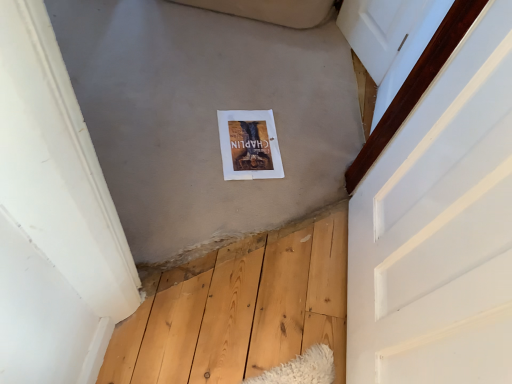
This screenshot has height=384, width=512. Describe the element at coordinates (440, 228) in the screenshot. I see `white painted wood door at upper right` at that location.

Identify the location of white painted wood door at upper right. (440, 228).

In order to click on white painted wood door at upper right in this screenshot , I will do (x=440, y=228).